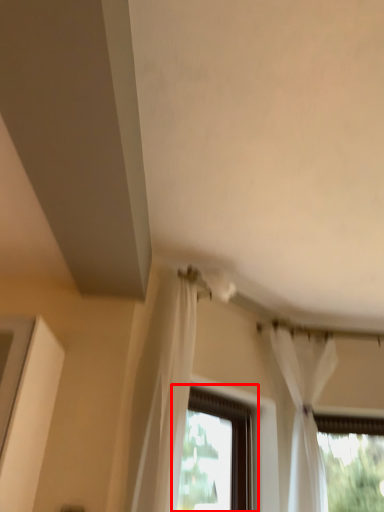
Question: From the image's perspective, what is the correct spatial relationship of window (annotated by the red box) in relation to curtain?

Choices:
 (A) below
 (B) above

Answer: (A)